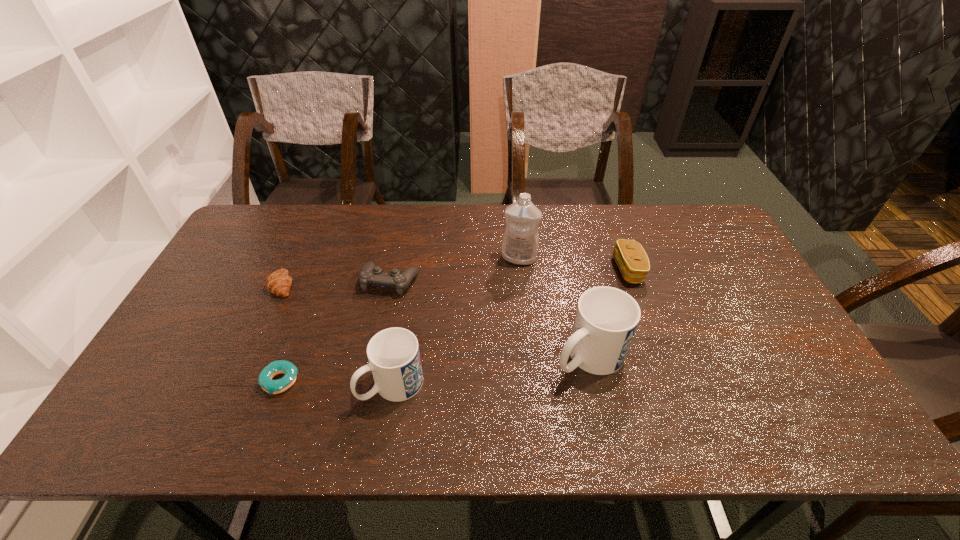
In order to click on free space located 0.080m on the zipper side of the fourth shortest object in this screenshot , I will do `click(588, 270)`.

Image resolution: width=960 pixels, height=540 pixels. I want to click on free region located on the right of the second object from left to right, so [449, 381].

Locate an element on the screen. Image resolution: width=960 pixels, height=540 pixels. doughnut present at the near edge is located at coordinates (274, 368).

Locate an element on the screen. The image size is (960, 540). vacant space at the far edge of the desktop is located at coordinates (573, 206).

At what (x,y) coordinates should I click in order to perform the action: click on free space at the near edge of the desktop. Please return your answer as a coordinate pair (x, y). This screenshot has height=540, width=960. Looking at the image, I should click on (629, 401).

The image size is (960, 540). In the image, there is a desktop. Identify the location of vacant space at the left edge. (212, 280).

In the image, there is a desktop. Identify the location of vacant space at the right edge. (717, 270).

In the image, there is a desktop. Identify the location of free space at the far left corner. This screenshot has height=540, width=960. (255, 240).

This screenshot has height=540, width=960. What are the coordinates of `blank space at the far right corner of the desktop` in the screenshot? It's located at (701, 220).

The image size is (960, 540). In order to click on free space at the near right corner in this screenshot , I will do `click(815, 394)`.